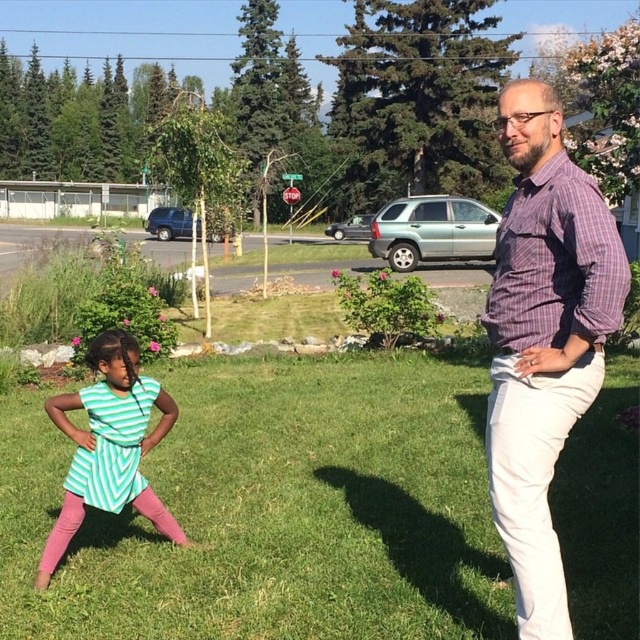
You are a photographer trying to capture both the purple checkered shirt at right and the green striped dress at lower left in a single frame. Which object should you focus on first to ensure both are in the frame?

You should focus on the green striped dress at lower left first because it occupies more space and will require more attention to frame properly, ensuring the purple checkered shirt at right also fits in the composition.

You are standing in the park and want to place a small picnic basket on the green grass at center. What are the coordinates where you should place it?

The coordinates for the green grass at center are point (275, 509), so you should place the picnic basket there.